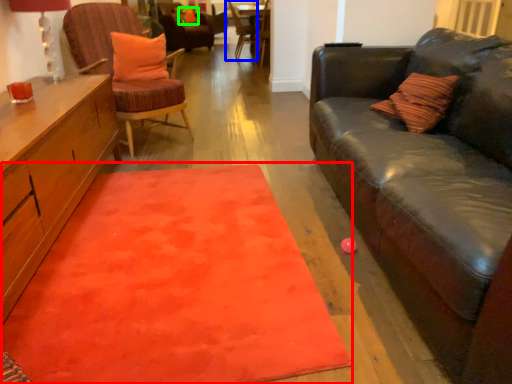
Question: Which is farther away from mat (highlighted by a red box)? chair (highlighted by a blue box) or pillow (highlighted by a green box)?

Choices:
 (A) chair
 (B) pillow

Answer: (B)